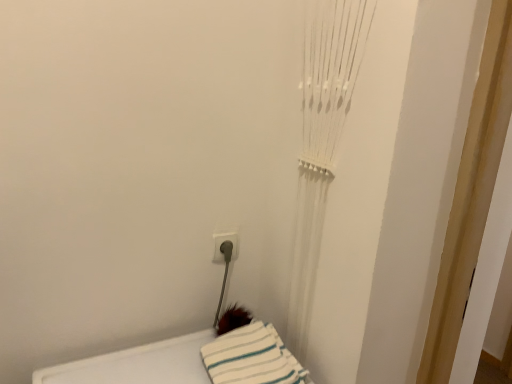
Question: Is white plastic electric outlet at lower center wider or thinner than white striped fabric at lower center?

Choices:
 (A) wide
 (B) thin

Answer: (B)

Question: In the image, is white plastic electric outlet at lower center on the left side or the right side of white striped fabric at lower center?

Choices:
 (A) right
 (B) left

Answer: (B)

Question: From a real-world perspective, is white plastic electric outlet at lower center positioned above or below white striped fabric at lower center?

Choices:
 (A) above
 (B) below

Answer: (A)

Question: Considering the positions of point (250, 327) and point (234, 246), is point (250, 327) closer or farther from the camera than point (234, 246)?

Choices:
 (A) farther
 (B) closer

Answer: (B)

Question: Is white striped fabric at lower center bigger or smaller than white plastic electric outlet at lower center?

Choices:
 (A) big
 (B) small

Answer: (A)

Question: Considering the positions of white striped fabric at lower center and white plastic electric outlet at lower center in the image, is white striped fabric at lower center taller or shorter than white plastic electric outlet at lower center?

Choices:
 (A) tall
 (B) short

Answer: (B)

Question: From a real-world perspective, is white striped fabric at lower center above or below white plastic electric outlet at lower center?

Choices:
 (A) above
 (B) below

Answer: (B)